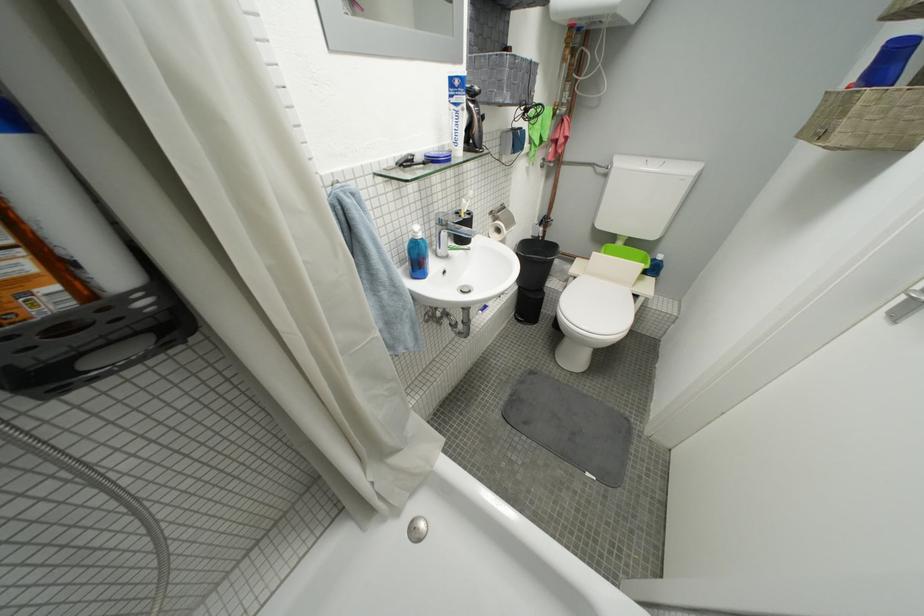
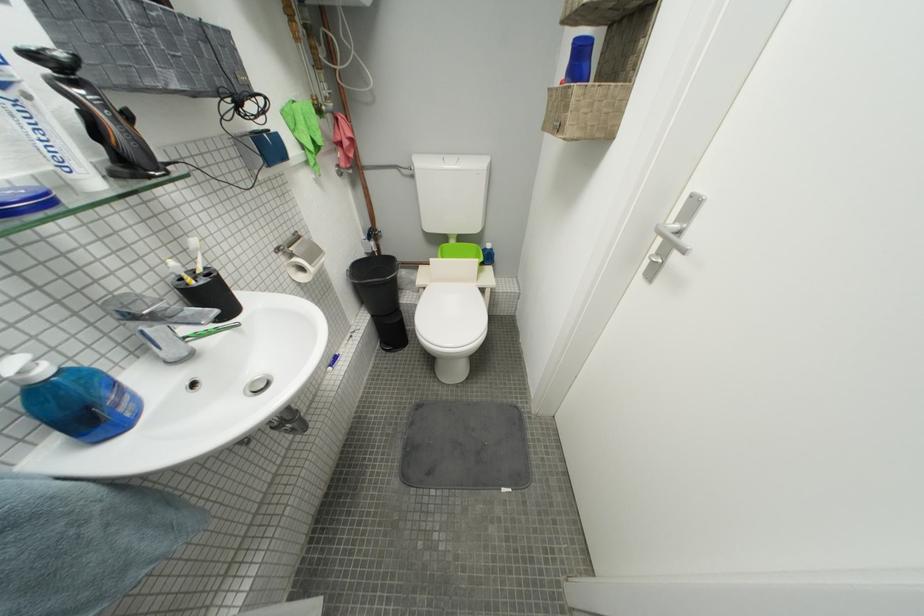
Find the pixel in the second image that matches the point at 864,83 in the first image.

(573, 78)